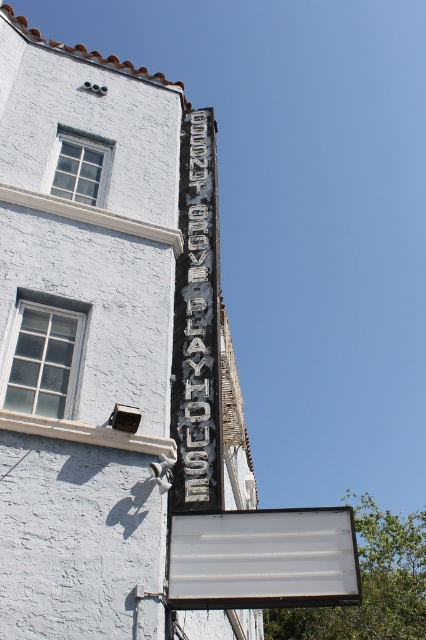
Does white matte sign at center have a lesser width compared to black metal sign at upper center?

No, white matte sign at center is not thinner than black metal sign at upper center.

Who is positioned more to the left, white matte sign at center or black metal sign at upper center?

black metal sign at upper center is more to the left.

Is point (210, 550) closer to viewer compared to point (187, 120)?

Yes, it is.

Where is `white matte sign at center`? Image resolution: width=426 pixels, height=640 pixels. white matte sign at center is located at coordinates (264, 557).